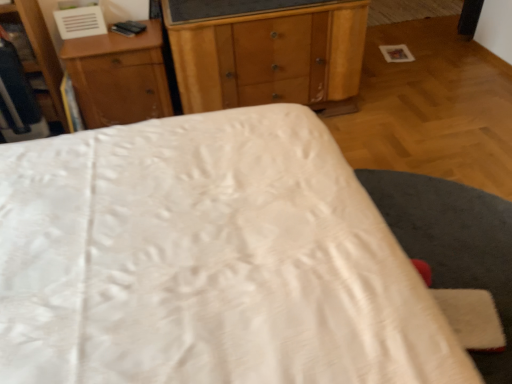
Question: From a real-world perspective, is white satin bed at center on wooden nightstand at upper center?

Choices:
 (A) yes
 (B) no

Answer: (A)

Question: Considering the relative sizes of white satin bed at center and wooden nightstand at upper center in the image provided, is white satin bed at center wider than wooden nightstand at upper center?

Choices:
 (A) yes
 (B) no

Answer: (A)

Question: Is wooden nightstand at upper center completely or partially inside white satin bed at center?

Choices:
 (A) yes
 (B) no

Answer: (B)

Question: Does white satin bed at center have a larger size compared to wooden nightstand at upper center?

Choices:
 (A) no
 (B) yes

Answer: (B)

Question: Can you confirm if white satin bed at center is thinner than wooden nightstand at upper center?

Choices:
 (A) yes
 (B) no

Answer: (B)

Question: Does white satin bed at center have a greater height compared to wooden nightstand at upper center?

Choices:
 (A) no
 (B) yes

Answer: (B)

Question: Is wooden chest of drawers at center positioned with its back to wooden dresser at left?

Choices:
 (A) no
 (B) yes

Answer: (A)

Question: Does wooden chest of drawers at center have a smaller size compared to wooden dresser at left?

Choices:
 (A) no
 (B) yes

Answer: (A)

Question: Is wooden chest of drawers at center positioned before wooden dresser at left?

Choices:
 (A) yes
 (B) no

Answer: (B)

Question: From the image's perspective, is wooden chest of drawers at center beneath wooden dresser at left?

Choices:
 (A) yes
 (B) no

Answer: (B)

Question: From a real-world perspective, is wooden chest of drawers at center located higher than wooden dresser at left?

Choices:
 (A) no
 (B) yes

Answer: (A)

Question: Is wooden chest of drawers at center further to the viewer compared to wooden dresser at left?

Choices:
 (A) yes
 (B) no

Answer: (A)

Question: Does white satin bed at center have a greater height compared to wooden dresser at left?

Choices:
 (A) no
 (B) yes

Answer: (B)